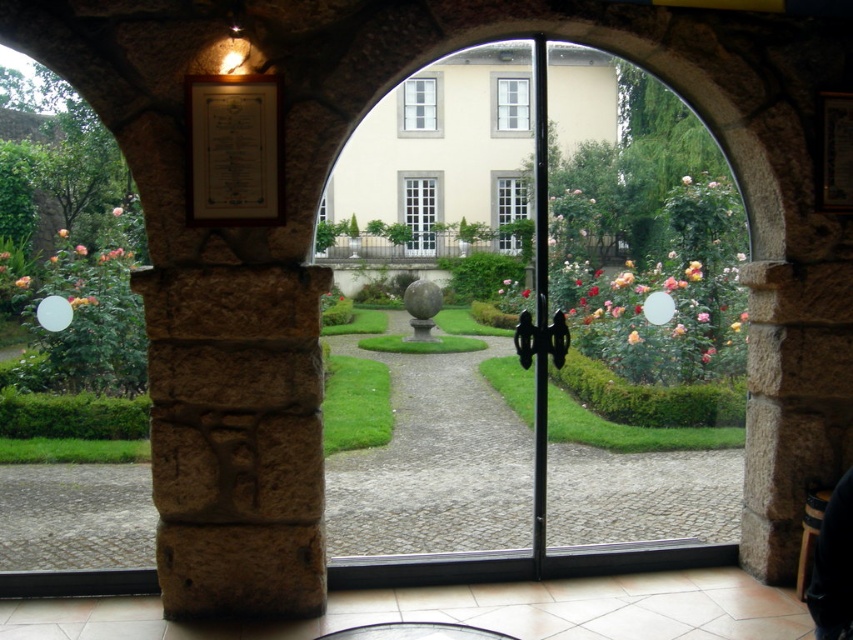
Can you confirm if clear glass door at center is wider than white tile floor at center?

Indeed, clear glass door at center has a greater width compared to white tile floor at center.

Is point (509, 253) closer to camera compared to point (219, 628)?

No, it is behind (219, 628).

Find the location of a particular element. clear glass door at center is located at coordinates (440, 317).